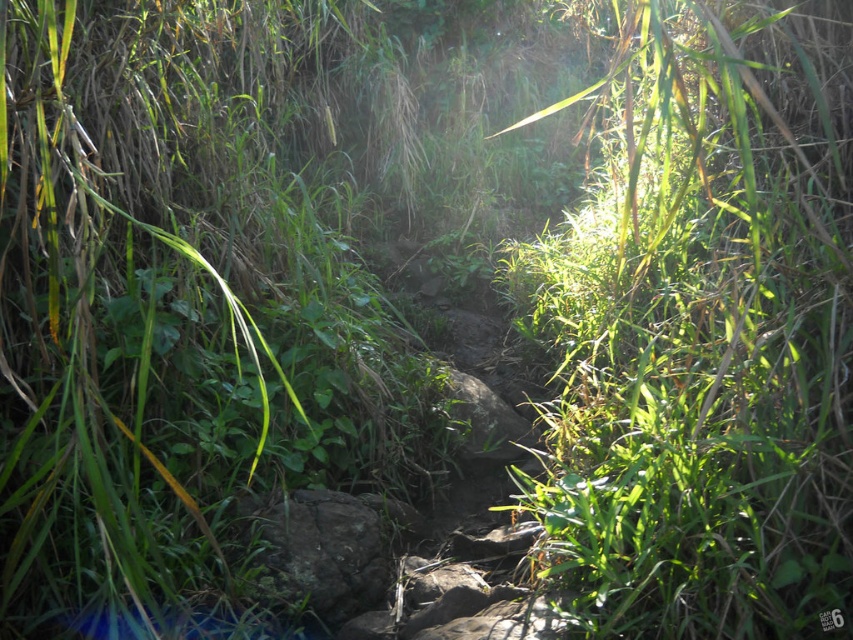
Based on the photo, who is more forward, (572, 394) or (329, 556)?

Positioned in front is point (329, 556).

Who is lower down, green leafy grass at center or gray rough rock at center?

Positioned lower is gray rough rock at center.

The image size is (853, 640). I want to click on green leafy grass at center, so click(x=700, y=330).